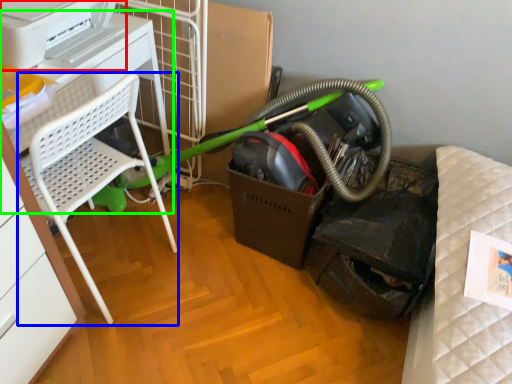
Question: Which object is the farthest from printer (highlighted by a red box)? Choose among these: furniture (highlighted by a blue box) or table (highlighted by a green box).

Choices:
 (A) furniture
 (B) table

Answer: (A)